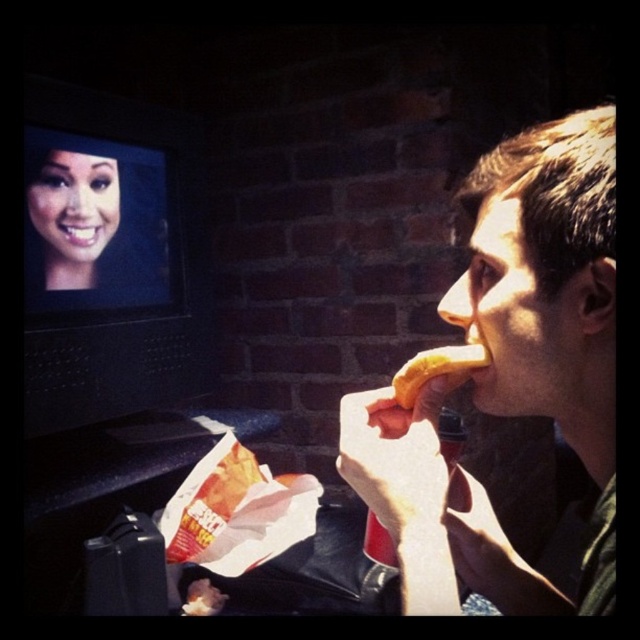
Question: Observing the image, what is the correct spatial positioning of smooth skin face at upper left in reference to golden bread at mouth?

Choices:
 (A) right
 (B) left

Answer: (B)

Question: Can you confirm if matte yellow hot dog at right is smaller than smooth skin face at upper left?

Choices:
 (A) no
 (B) yes

Answer: (A)

Question: Does matte yellow hot dog at right appear over smooth skin face at upper left?

Choices:
 (A) no
 (B) yes

Answer: (A)

Question: Based on their relative distances, which object is nearer to the smooth skin face at upper left?

Choices:
 (A) golden bread at mouth
 (B) matte yellow hot dog at right

Answer: (A)

Question: Among these objects, which one is farthest from the camera?

Choices:
 (A) smooth skin face at upper left
 (B) matte yellow hot dog at right

Answer: (A)

Question: Which object is positioned closest to the golden bread at mouth?

Choices:
 (A) matte yellow hot dog at right
 (B) smooth skin face at upper left

Answer: (A)